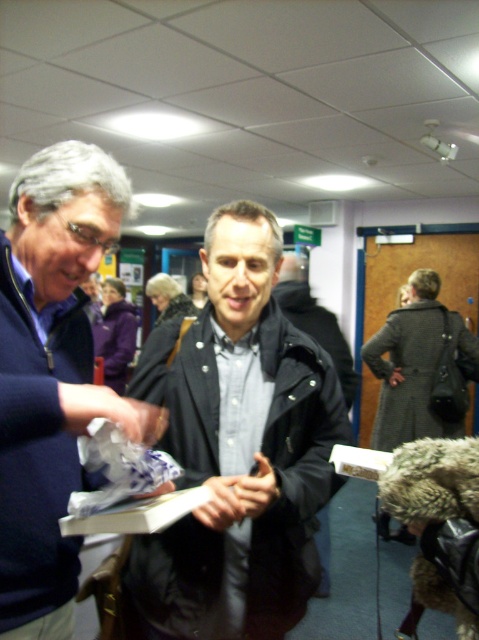
Question: Can you confirm if matte black jacket at center is wider than dark gray fabric coat at center?

Choices:
 (A) yes
 (B) no

Answer: (A)

Question: Which object appears farthest from the camera in this image?

Choices:
 (A) blue sweater at left
 (B) dark gray fabric coat at center

Answer: (B)

Question: Estimate the real-world distances between objects in this image. Which object is closer to the blue sweater at left?

Choices:
 (A) dark gray fabric coat at center
 (B) matte black jacket at center

Answer: (B)

Question: Does matte black jacket at center have a greater width compared to dark gray fabric coat at center?

Choices:
 (A) no
 (B) yes

Answer: (B)

Question: Is matte black jacket at center smaller than dark gray fabric coat at center?

Choices:
 (A) no
 (B) yes

Answer: (B)

Question: Which object appears closest to the camera in this image?

Choices:
 (A) dark gray fabric coat at center
 (B) blue sweater at left

Answer: (B)